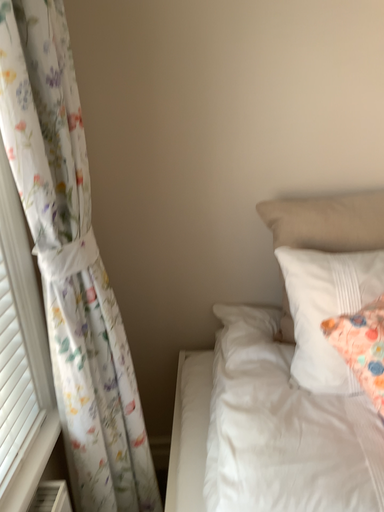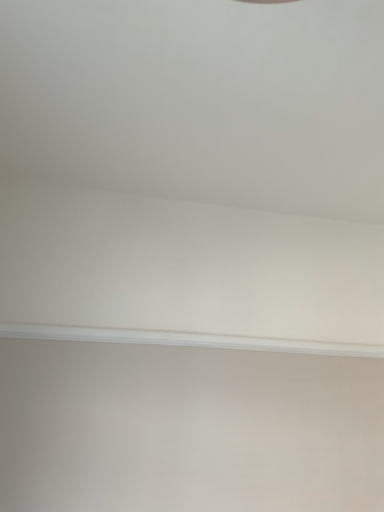
Question: How did the camera likely rotate when shooting the video?

Choices:
 (A) rotated downward
 (B) rotated upward

Answer: (B)